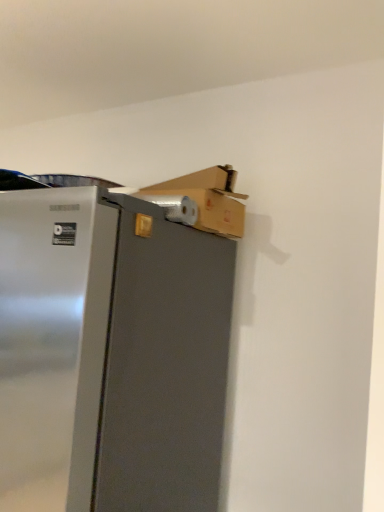
Question: Are cardboard box at upper right and satin silver refrigerator at upper left located far from each other?

Choices:
 (A) yes
 (B) no

Answer: (B)

Question: Are cardboard box at upper right and satin silver refrigerator at upper left making contact?

Choices:
 (A) no
 (B) yes

Answer: (A)

Question: From a real-world perspective, is cardboard box at upper right physically above satin silver refrigerator at upper left?

Choices:
 (A) no
 (B) yes

Answer: (B)

Question: Is cardboard box at upper right positioned beyond the bounds of satin silver refrigerator at upper left?

Choices:
 (A) no
 (B) yes

Answer: (B)

Question: Considering the relative sizes of cardboard box at upper right and satin silver refrigerator at upper left in the image provided, is cardboard box at upper right wider than satin silver refrigerator at upper left?

Choices:
 (A) yes
 (B) no

Answer: (B)

Question: Considering the relative sizes of cardboard box at upper right and satin silver refrigerator at upper left in the image provided, is cardboard box at upper right shorter than satin silver refrigerator at upper left?

Choices:
 (A) no
 (B) yes

Answer: (B)

Question: Does satin silver refrigerator at upper left lie in front of cardboard box at upper right?

Choices:
 (A) no
 (B) yes

Answer: (B)

Question: Is satin silver refrigerator at upper left to the left of cardboard box at upper right from the viewer's perspective?

Choices:
 (A) no
 (B) yes

Answer: (B)

Question: Is cardboard box at upper right completely or partially inside satin silver refrigerator at upper left?

Choices:
 (A) yes
 (B) no

Answer: (B)

Question: Can you confirm if satin silver refrigerator at upper left is smaller than cardboard box at upper right?

Choices:
 (A) no
 (B) yes

Answer: (A)

Question: From a real-world perspective, is satin silver refrigerator at upper left physically above cardboard box at upper right?

Choices:
 (A) no
 (B) yes

Answer: (A)

Question: Would you consider satin silver refrigerator at upper left to be distant from cardboard box at upper right?

Choices:
 (A) no
 (B) yes

Answer: (A)

Question: Choose the correct answer: Is satin silver refrigerator at upper left inside cardboard box at upper right or outside it?

Choices:
 (A) inside
 (B) outside

Answer: (B)